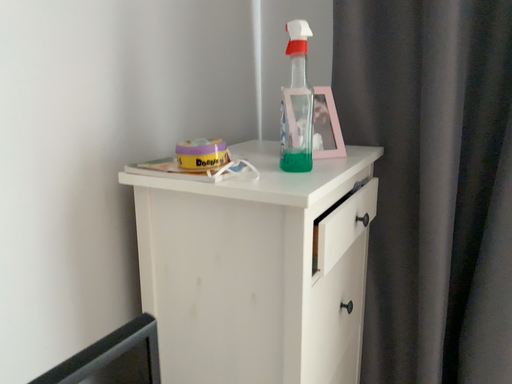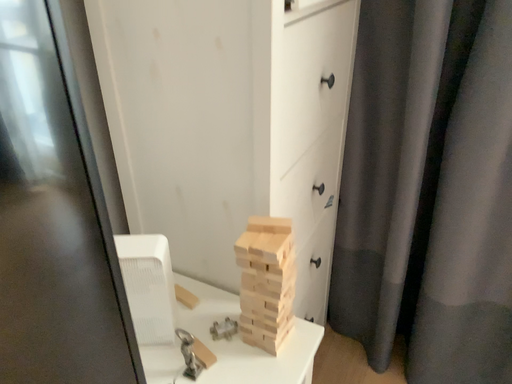
Question: How did the camera likely rotate when shooting the video?

Choices:
 (A) rotated upward
 (B) rotated downward

Answer: (B)